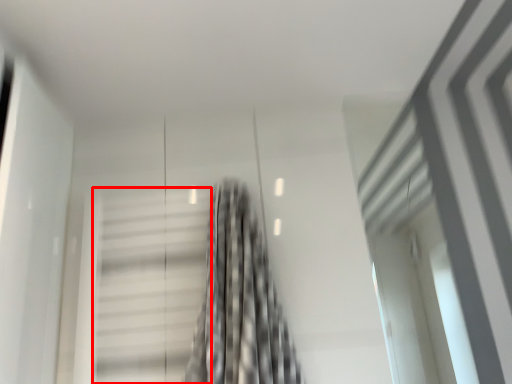
Question: From the image, what is the correct spatial relationship of stairs (annotated by the red box) in relation to curtain?

Choices:
 (A) left
 (B) right

Answer: (A)